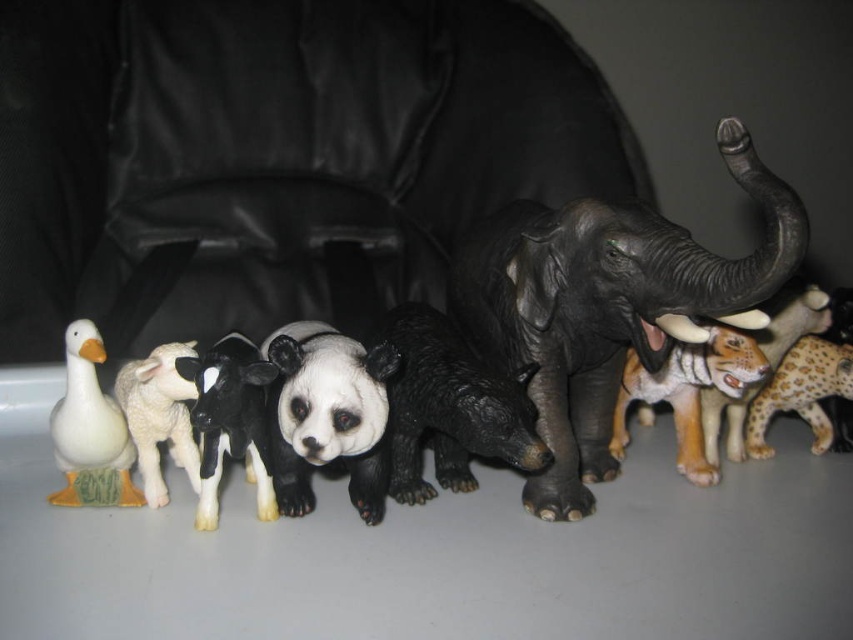
You are standing at the point marked as point [776,243] and want to reach the door located at the opposite side of the room. There is a 30 inch wide sofa between you and the door. Can you walk through the space between the sofa and the wall without bending?

The distance between you and the sofa is 32.01 inches, which is slightly more than the sofa width of 30 inches. Therefore, there is enough space to walk through without bending.

You are organizing a toy display and need to place the black rubber elephant at center and the black matte bear at center on a shelf. If the shelf has a width of 30 cm, can both toys fit side by side without overlapping?

The black rubber elephant at center might be wider than the black matte bear at center, so it is uncertain if both can fit on a 30 cm shelf without overlapping. Measure their combined widths to confirm.